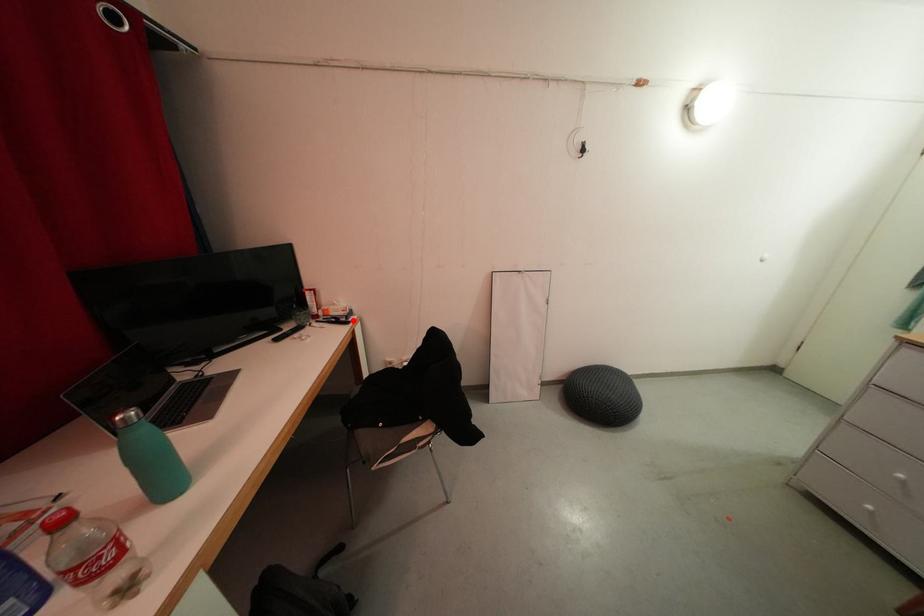
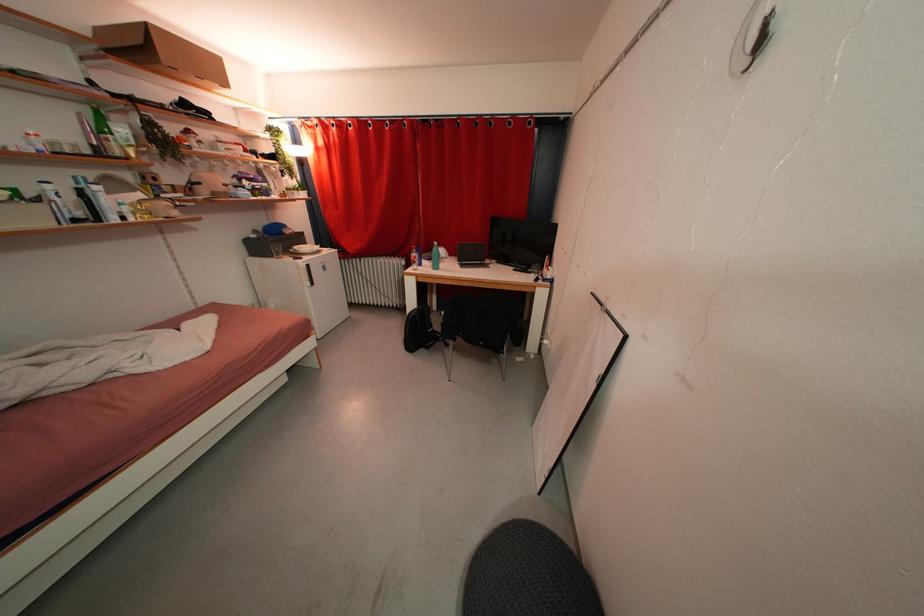
In the second image, find the point that corresponds to the highlighted location in the first image.

(551, 284)